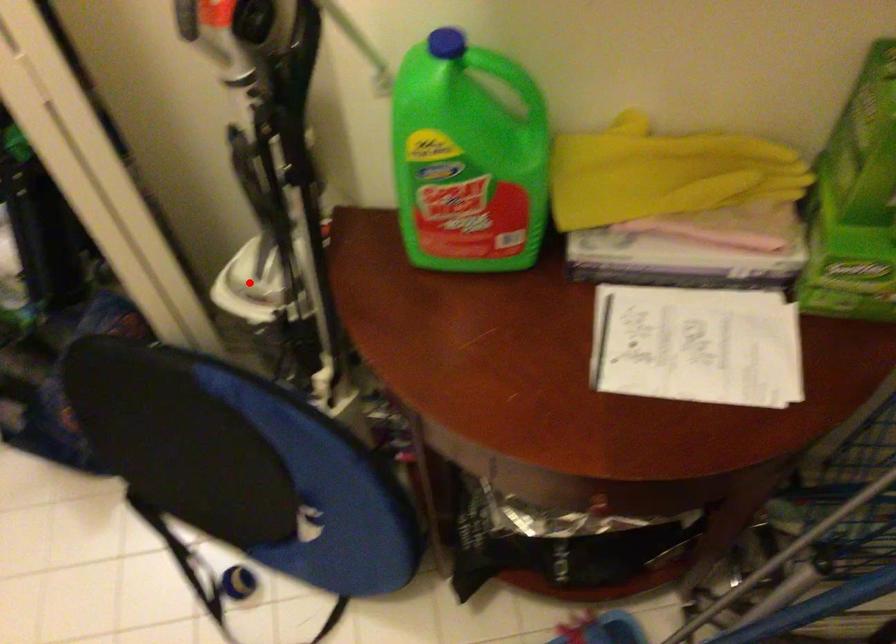
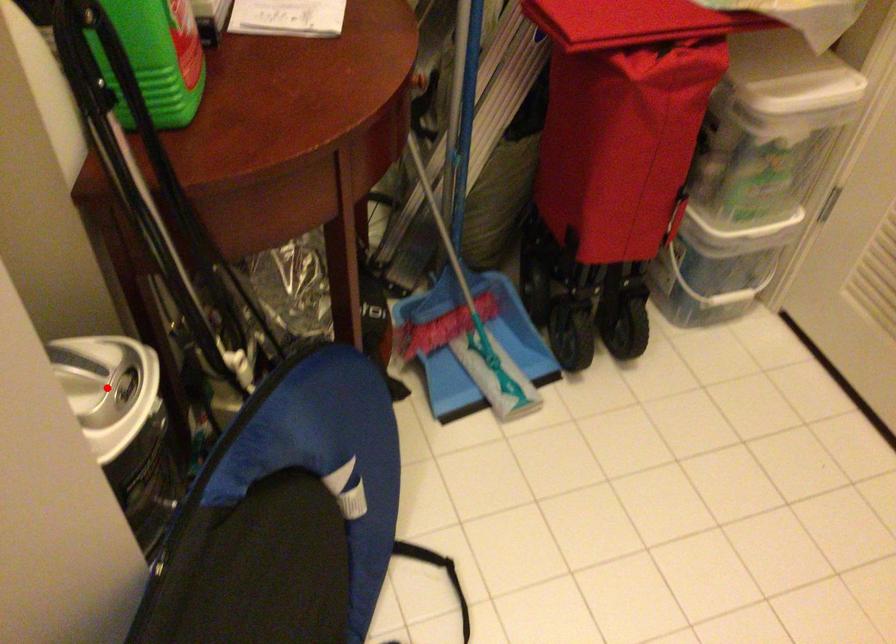
I am providing you with two images of the same scene from different viewpoints. A red point is marked on the first image and another point is marked on the second image. Do the highlighted points in image1 and image2 indicate the same real-world spot?

Yes